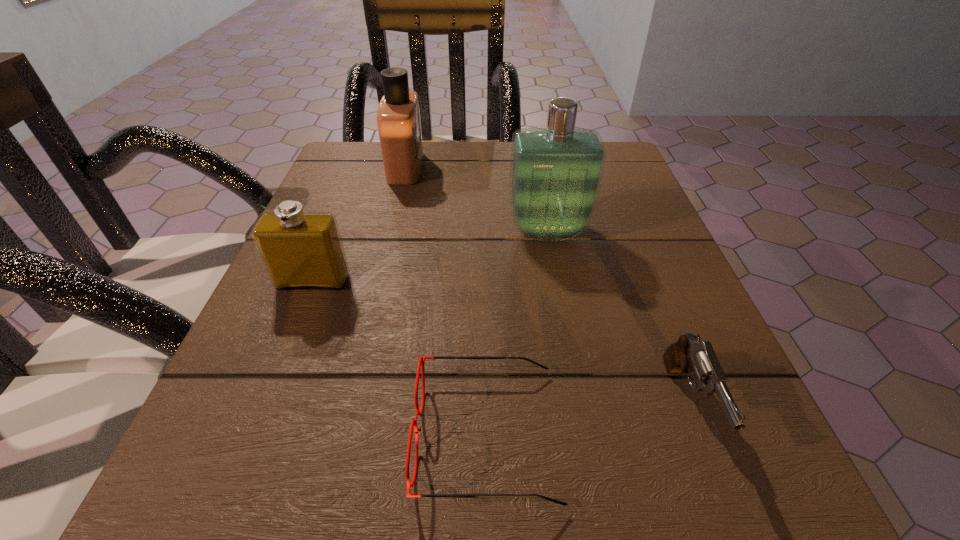
This screenshot has height=540, width=960. Identify the location of object that is at the far left corner. (398, 115).

This screenshot has height=540, width=960. I want to click on object that is at the near right corner, so click(689, 354).

What are the coordinates of `free spot at the far edge of the desktop` in the screenshot? It's located at (427, 161).

The width and height of the screenshot is (960, 540). What are the coordinates of `free location at the near edge` in the screenshot? It's located at (394, 498).

Image resolution: width=960 pixels, height=540 pixels. What are the coordinates of `vacant area at the left edge of the desktop` in the screenshot? It's located at (252, 334).

Where is `vacant area at the right edge of the desktop`? vacant area at the right edge of the desktop is located at coordinates (709, 414).

Locate an element on the screen. This screenshot has width=960, height=540. free spot at the near left corner of the desktop is located at coordinates (294, 498).

Where is `vacant space at the near right corner of the desktop`? The image size is (960, 540). vacant space at the near right corner of the desktop is located at coordinates (751, 476).

Locate an element on the screen. The image size is (960, 540). vacant region between the second perfume from left to right and the shortest perfume is located at coordinates (359, 225).

Where is `free spot between the rightmost object and the leftmost object`? free spot between the rightmost object and the leftmost object is located at coordinates (500, 343).